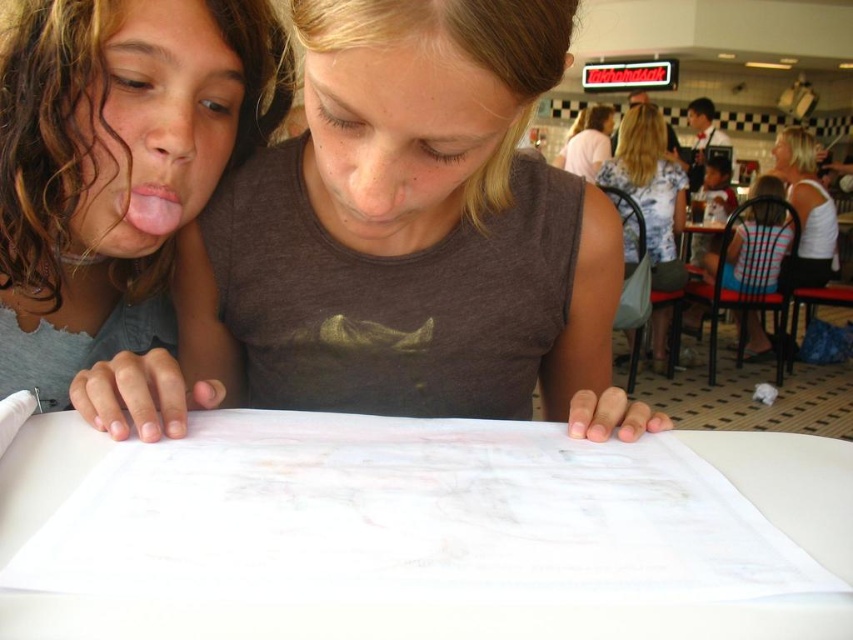
Question: Estimate the real-world distances between objects in this image. Which object is farther from the matte brown shirt at center?

Choices:
 (A) light pink shirt at upper center
 (B) white fabric shirt at upper right
 (C) striped fabric shirt at right

Answer: (A)

Question: Does matte brown shirt at center have a larger size compared to light pink shirt at upper center?

Choices:
 (A) no
 (B) yes

Answer: (A)

Question: Which point appears closest to the camera in this image?

Choices:
 (A) (752, 328)
 (B) (509, 266)
 (C) (598, 179)
 (D) (573, 145)

Answer: (B)

Question: Can you confirm if floral blouse at right is smaller than white fabric shirt at upper right?

Choices:
 (A) yes
 (B) no

Answer: (B)

Question: Is white fabric shirt at upper right positioned behind light pink shirt at upper center?

Choices:
 (A) yes
 (B) no

Answer: (B)

Question: Which of the following is the closest to the observer?

Choices:
 (A) (572, 166)
 (B) (184, 188)

Answer: (B)